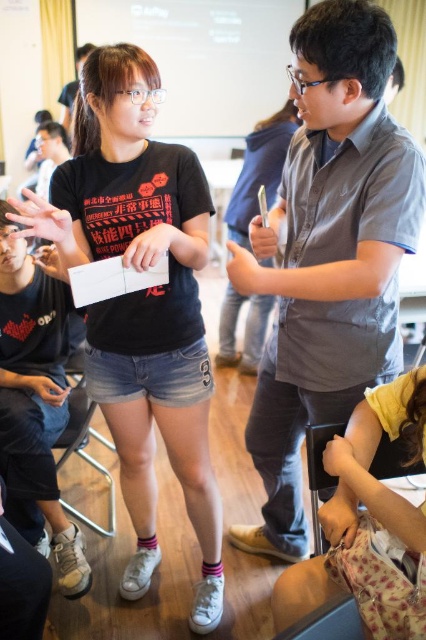
Question: Does gray cotton shirt at center have a lesser width compared to black matte t-shirt at center?

Choices:
 (A) yes
 (B) no

Answer: (A)

Question: Which point appears closest to the camera in this image?

Choices:
 (A) (209, 400)
 (B) (305, 352)

Answer: (B)

Question: Which point is farther from the camera taking this photo?

Choices:
 (A) (75, 166)
 (B) (276, 545)

Answer: (B)

Question: Can you confirm if gray cotton shirt at center is positioned to the left of black matte t-shirt at center?

Choices:
 (A) yes
 (B) no

Answer: (B)

Question: Is gray cotton shirt at center bigger than black matte t-shirt at center?

Choices:
 (A) no
 (B) yes

Answer: (B)